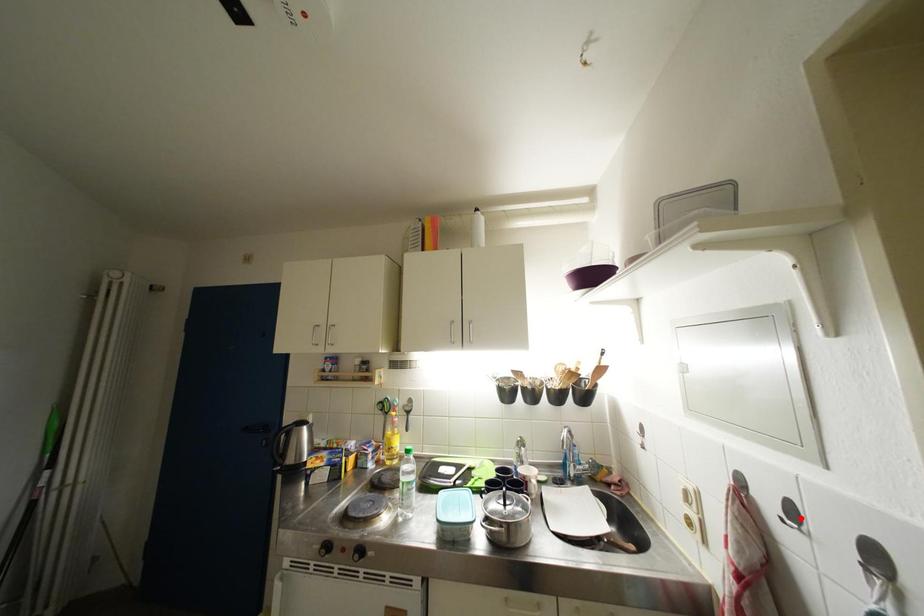
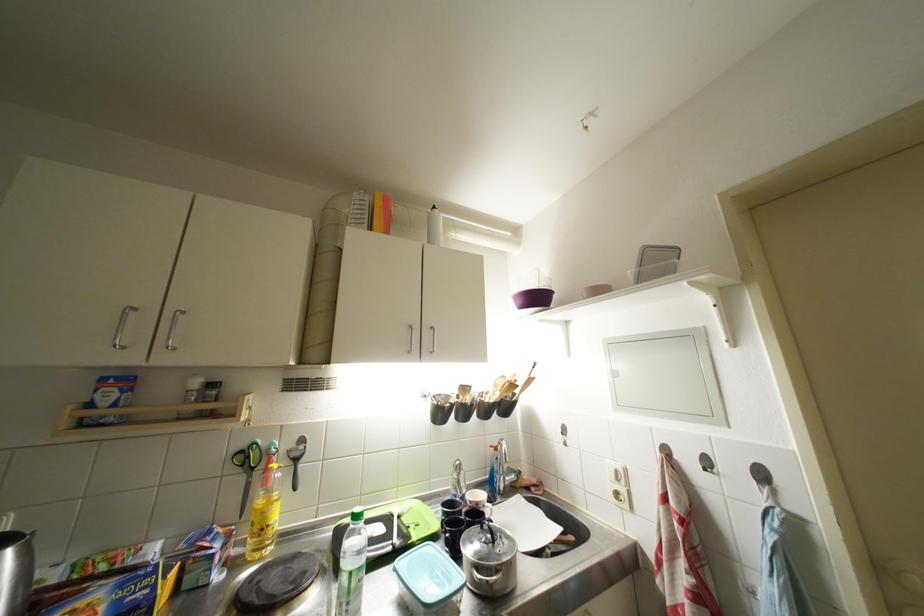
The point at the highlighted location is marked in the first image. Where is the corresponding point in the second image?

(714, 467)